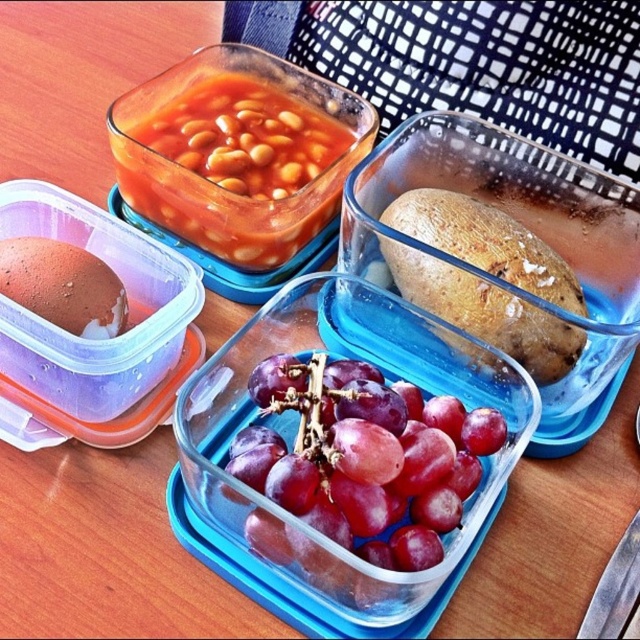
You are looking at the image of the food containers. There are two points marked in the scene. The first point is at coordinate point (561,332) and the second is at point (120,308). Which of these two points is closer to you?

Point (561,332) is further to the camera than point (120,308), so the point closer to you is point (120,308).